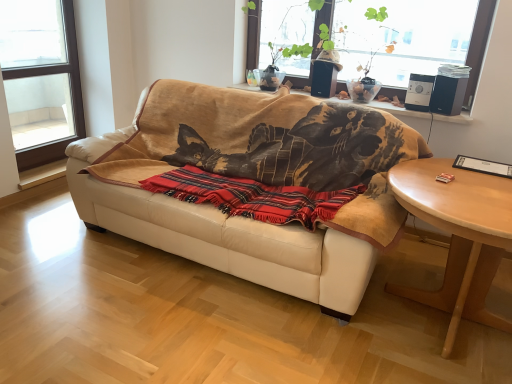
Question: Could you tell me if red plaid blanket at center is turned towards transparent glass window at upper left, the 2th window positioned from the right?

Choices:
 (A) no
 (B) yes

Answer: (A)

Question: Can you confirm if red plaid blanket at center is taller than transparent glass window at upper left, the 2th window positioned from the right?

Choices:
 (A) no
 (B) yes

Answer: (A)

Question: Could transparent glass window at upper left, which is counted as the 1th window, starting from the left, be considered to be inside red plaid blanket at center?

Choices:
 (A) no
 (B) yes

Answer: (A)

Question: Considering the relative sizes of red plaid blanket at center and transparent glass window at upper left, the 2th window positioned from the right, in the image provided, is red plaid blanket at center wider than transparent glass window at upper left, the 2th window positioned from the right,?

Choices:
 (A) no
 (B) yes

Answer: (B)

Question: Is red plaid blanket at center positioned beyond the bounds of transparent glass window at upper left, which is counted as the 1th window, starting from the left?

Choices:
 (A) no
 (B) yes

Answer: (B)

Question: Can you confirm if red plaid blanket at center is positioned to the right of transparent glass window at upper left, which is counted as the 1th window, starting from the left?

Choices:
 (A) no
 (B) yes

Answer: (B)

Question: From a real-world perspective, is red plaid blanket at center physically below beige leather couch at center?

Choices:
 (A) no
 (B) yes

Answer: (A)

Question: Is red plaid blanket at center closer to the viewer compared to beige leather couch at center?

Choices:
 (A) yes
 (B) no

Answer: (B)

Question: Is beige leather couch at center at the back of red plaid blanket at center?

Choices:
 (A) no
 (B) yes

Answer: (B)

Question: Is red plaid blanket at center bigger than beige leather couch at center?

Choices:
 (A) no
 (B) yes

Answer: (A)

Question: Is red plaid blanket at center facing towards beige leather couch at center?

Choices:
 (A) yes
 (B) no

Answer: (A)

Question: Are red plaid blanket at center and beige leather couch at center far apart?

Choices:
 (A) yes
 (B) no

Answer: (B)

Question: Does transparent glass window at upper center, acting as the first window starting from the right, lie behind beige leather couch at center?

Choices:
 (A) yes
 (B) no

Answer: (A)